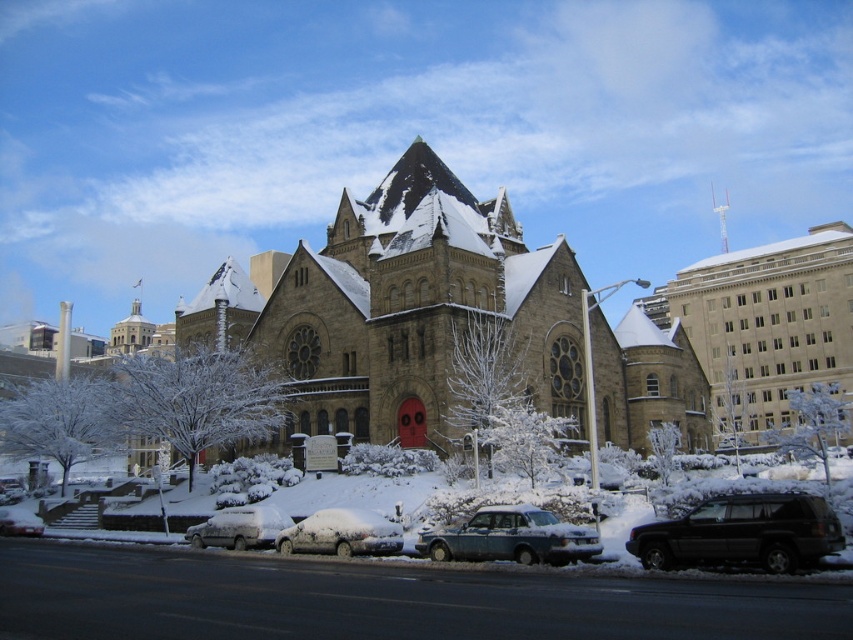
You are standing in front of the church and want to take a photo that includes both the brown stone church at center and the beige stone church at center. Which one should you focus on first to ensure both are in clear view?

You should focus on the brown stone church at center first because it is closer to you than the beige stone church at center, so adjusting focus from near to far will help both appear clear.